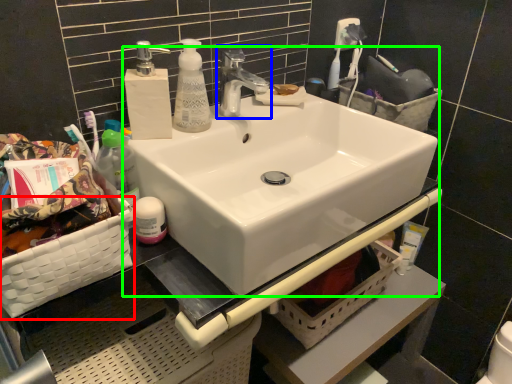
Question: Estimate the real-world distances between objects in this image. Which object is farther from basket (highlighted by a red box), tap (highlighted by a blue box) or sink (highlighted by a green box)?

Choices:
 (A) tap
 (B) sink

Answer: (A)